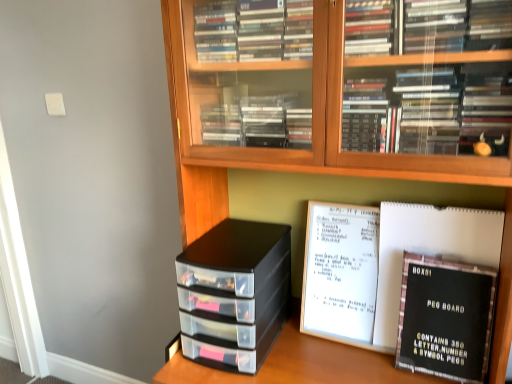
Question: Does black cardboard peg board at lower right have a lesser height compared to wooden bookcase at center?

Choices:
 (A) yes
 (B) no

Answer: (A)

Question: Is black cardboard peg board at lower right behind wooden bookcase at center?

Choices:
 (A) yes
 (B) no

Answer: (A)

Question: Could you tell me if black cardboard peg board at lower right is turned towards wooden bookcase at center?

Choices:
 (A) yes
 (B) no

Answer: (A)

Question: From a real-world perspective, is black cardboard peg board at lower right positioned under wooden bookcase at center based on gravity?

Choices:
 (A) yes
 (B) no

Answer: (A)

Question: From the image's perspective, is black cardboard peg board at lower right under wooden bookcase at center?

Choices:
 (A) yes
 (B) no

Answer: (A)

Question: Is point (192, 352) closer or farther from the camera than point (184, 190)?

Choices:
 (A) farther
 (B) closer

Answer: (A)

Question: Considering their positions, is black plastic storage drawers at center located in front of or behind wooden bookcase at center?

Choices:
 (A) front
 (B) behind

Answer: (B)

Question: From the image's perspective, relative to wooden bookcase at center, is black plastic storage drawers at center above or below?

Choices:
 (A) above
 (B) below

Answer: (B)

Question: Considering the positions of black plastic storage drawers at center and wooden bookcase at center in the image, is black plastic storage drawers at center wider or thinner than wooden bookcase at center?

Choices:
 (A) wide
 (B) thin

Answer: (B)

Question: Is black cardboard peg board at lower right to the left or to the right of black plastic storage drawers at center in the image?

Choices:
 (A) left
 (B) right

Answer: (B)

Question: Considering the positions of black cardboard peg board at lower right and black plastic storage drawers at center in the image, is black cardboard peg board at lower right bigger or smaller than black plastic storage drawers at center?

Choices:
 (A) small
 (B) big

Answer: (A)

Question: Is black cardboard peg board at lower right inside or outside of black plastic storage drawers at center?

Choices:
 (A) outside
 (B) inside

Answer: (A)

Question: Considering the positions of black cardboard peg board at lower right and black plastic storage drawers at center in the image, is black cardboard peg board at lower right wider or thinner than black plastic storage drawers at center?

Choices:
 (A) wide
 (B) thin

Answer: (B)

Question: In terms of size, does black matte peg board at center right appear bigger or smaller than black cardboard peg board at lower right?

Choices:
 (A) small
 (B) big

Answer: (B)

Question: Is black matte peg board at center right taller or shorter than black cardboard peg board at lower right?

Choices:
 (A) tall
 (B) short

Answer: (A)